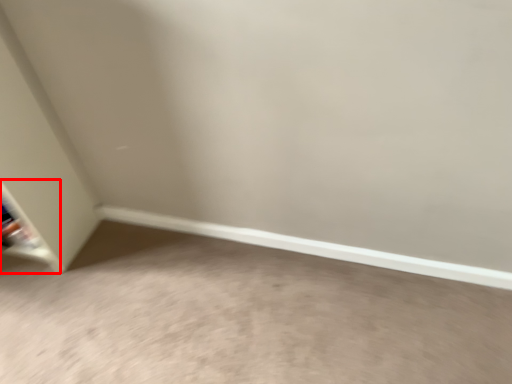
Question: From the image's perspective, where is shelf (annotated by the red box) located relative to concrete?

Choices:
 (A) above
 (B) below

Answer: (A)